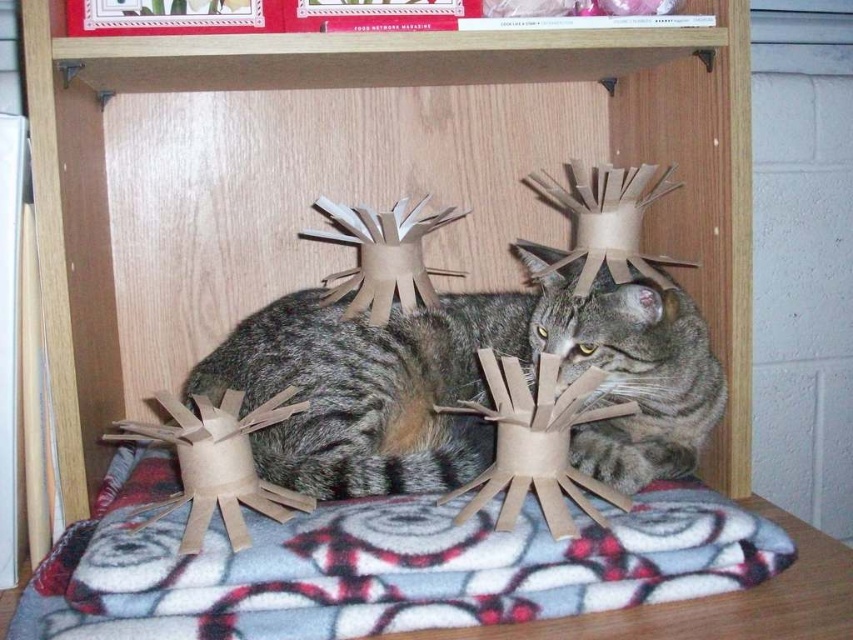
Can you confirm if tabby fur cat at center is positioned below tabby fur cat head at center?

Correct, tabby fur cat at center is located below tabby fur cat head at center.

Between tabby fur cat at center and tabby fur cat head at center, which one is positioned lower?

tabby fur cat at center is below.

Locate an element on the screen. The height and width of the screenshot is (640, 853). tabby fur cat at center is located at coordinates (465, 384).